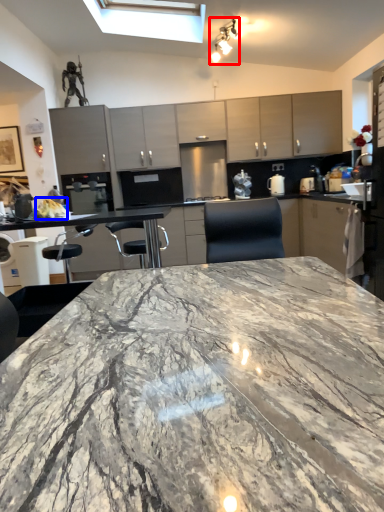
Question: Which of the following is the farthest to the observer, light fixture (highlighted by a red box) or food (highlighted by a blue box)?

Choices:
 (A) light fixture
 (B) food

Answer: (A)